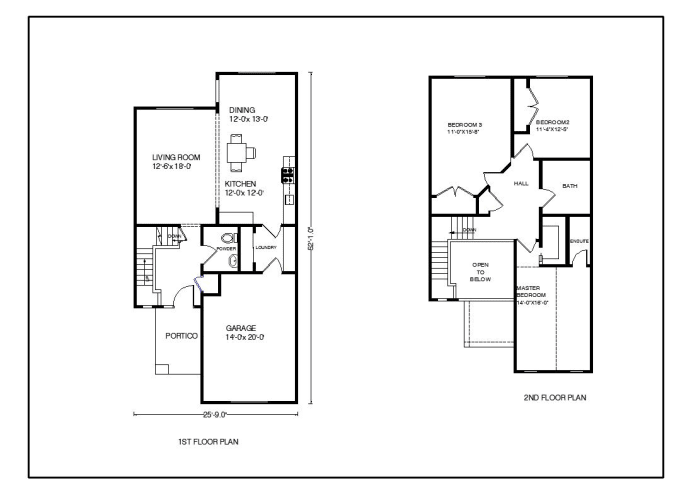
Find the location of a particular element. This screenshot has width=680, height=488. windows is located at coordinates (148, 306), (168, 305), (443, 299), (532, 372), (575, 371), (474, 76), (556, 76), (250, 72), (179, 106).